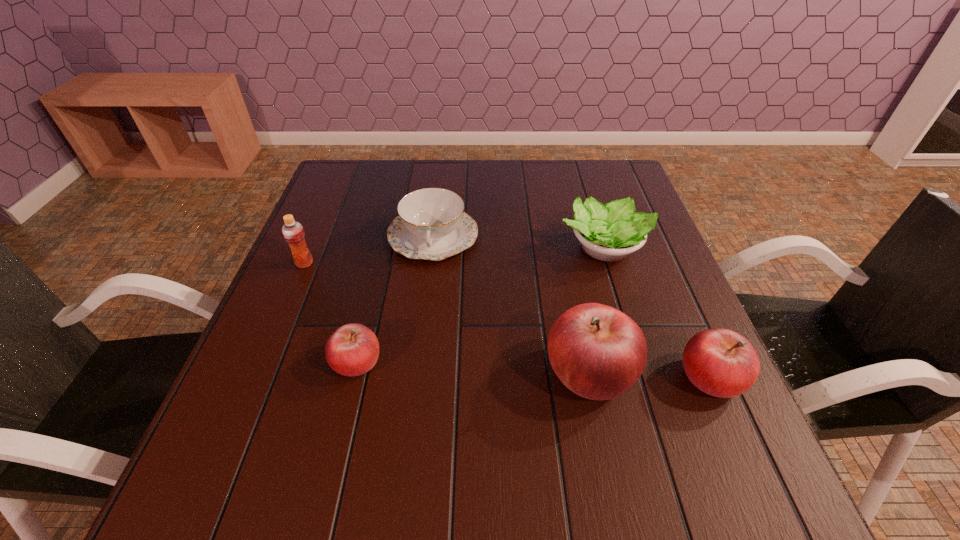
Where is `vacant point located 0.340m on the handle side of the chinaware`? This screenshot has height=540, width=960. vacant point located 0.340m on the handle side of the chinaware is located at coordinates (415, 389).

The height and width of the screenshot is (540, 960). I want to click on free region located 0.110m on the left of the lettuce, so click(x=514, y=248).

Image resolution: width=960 pixels, height=540 pixels. I want to click on vacant space located 0.270m on the back of the fifth shortest object, so click(333, 195).

I want to click on object located at the left edge, so click(x=293, y=232).

Identify the location of lettuce that is at the right edge. (610, 232).

In the image, there is a desktop. What are the coordinates of `free space at the far edge` in the screenshot? It's located at (533, 177).

Locate an element on the screen. The image size is (960, 540). vacant space at the left edge of the desktop is located at coordinates (327, 225).

In the image, there is a desktop. Identify the location of vacant area at the right edge. This screenshot has width=960, height=540. (641, 249).

Locate an element on the screen. The width and height of the screenshot is (960, 540). free point at the far left corner is located at coordinates (359, 176).

Find the location of a particular element. vacant space at the far right corner of the desktop is located at coordinates (604, 189).